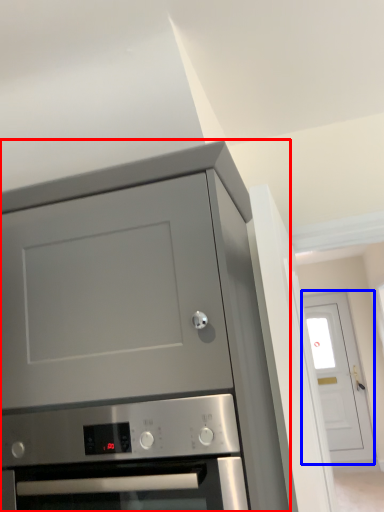
Question: Which object is closer to the camera taking this photo, cabinetry (highlighted by a red box) or door (highlighted by a blue box)?

Choices:
 (A) cabinetry
 (B) door

Answer: (A)